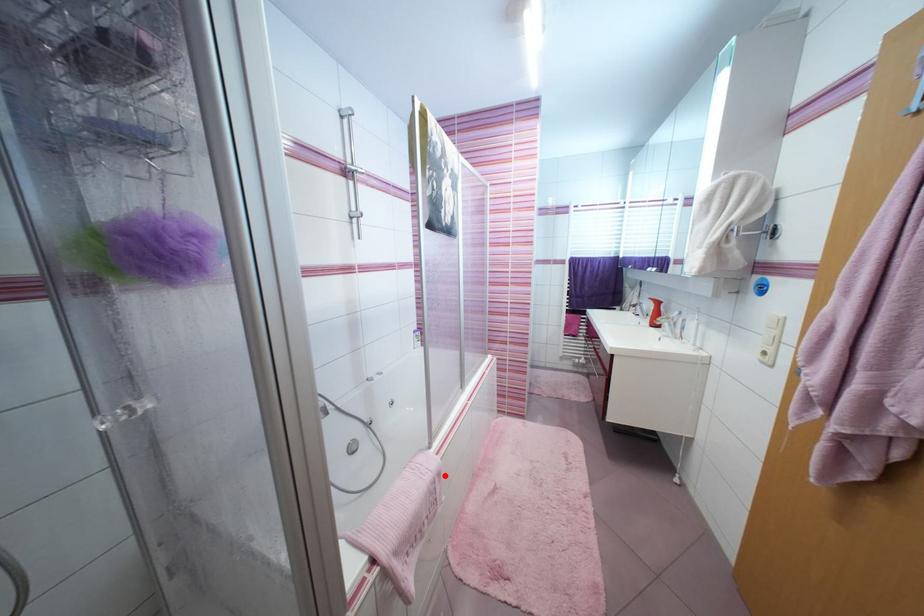
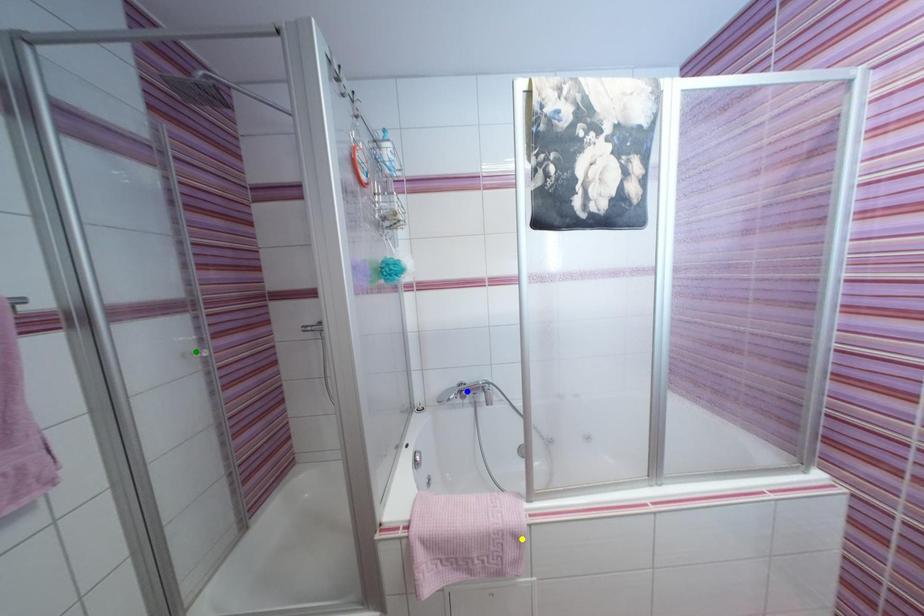
Question: I am providing you with two images of the same scene from different viewpoints. A red point is marked on the first image. You are given multiple points on the second image. Which spot in image 2 lines up with the point in image 1?

Choices:
 (A) yellow point
 (B) green point
 (C) blue point

Answer: (A)